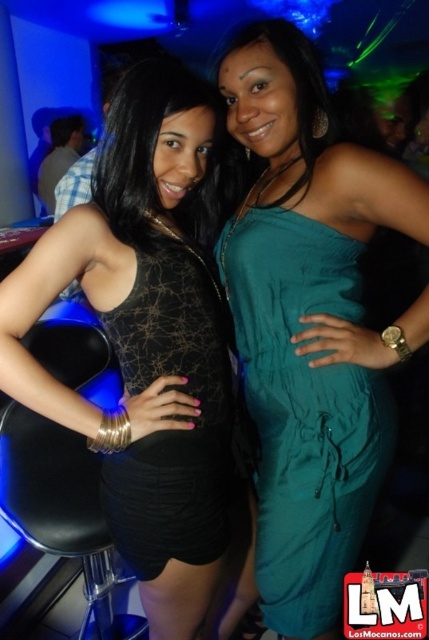
Who is lower down, matte black dress at center or black mesh dress at center?

matte black dress at center is below.

Is point (123, 454) positioned behind point (162, 536)?

That is True.

Locate an element on the screen. This screenshot has width=429, height=640. matte black dress at center is located at coordinates (151, 348).

Can you confirm if matte black dress at center is positioned to the left of teal fabric jumpsuit at center?

Correct, you'll find matte black dress at center to the left of teal fabric jumpsuit at center.

Who is higher up, matte black dress at center or teal fabric jumpsuit at center?

teal fabric jumpsuit at center is higher up.

This screenshot has width=429, height=640. Identify the location of matte black dress at center. (151, 348).

The height and width of the screenshot is (640, 429). Find the location of `teal fabric jumpsuit at center`. teal fabric jumpsuit at center is located at coordinates (311, 323).

In the scene shown: Is teal fabric jumpsuit at center to the right of black mesh dress at center from the viewer's perspective?

Correct, you'll find teal fabric jumpsuit at center to the right of black mesh dress at center.

Between point (296, 64) and point (223, 497), which one is positioned behind?

The point (223, 497) is behind.

I want to click on teal fabric jumpsuit at center, so [x=311, y=323].